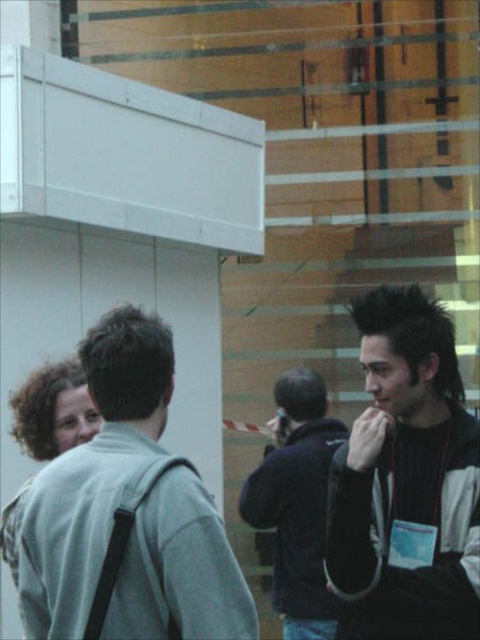
Question: Does black matte jacket at right have a greater width compared to curly brown hair at left?

Choices:
 (A) no
 (B) yes

Answer: (B)

Question: From the image, what is the correct spatial relationship of dark blue hoodie at center in relation to curly brown hair at left?

Choices:
 (A) left
 (B) right

Answer: (B)

Question: Which object appears farthest from the camera in this image?

Choices:
 (A) dark blue hoodie at center
 (B) black matte jacket at right

Answer: (A)

Question: Which object is the closest to the gray fabric jacket at left?

Choices:
 (A) dark blue hoodie at center
 (B) curly brown hair at left

Answer: (B)

Question: From the image, what is the correct spatial relationship of gray fabric jacket at left in relation to black matte jacket at right?

Choices:
 (A) above
 (B) below

Answer: (A)

Question: Which of the following is the farthest from the observer?

Choices:
 (A) gray fabric jacket at left
 (B) black matte jacket at right
 (C) curly brown hair at left
 (D) dark blue hoodie at center

Answer: (D)